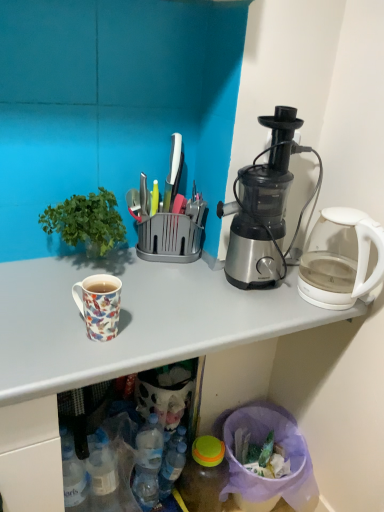
Identify the location of free point below green leafy plant at left (from a real-world perspective). (82, 269).